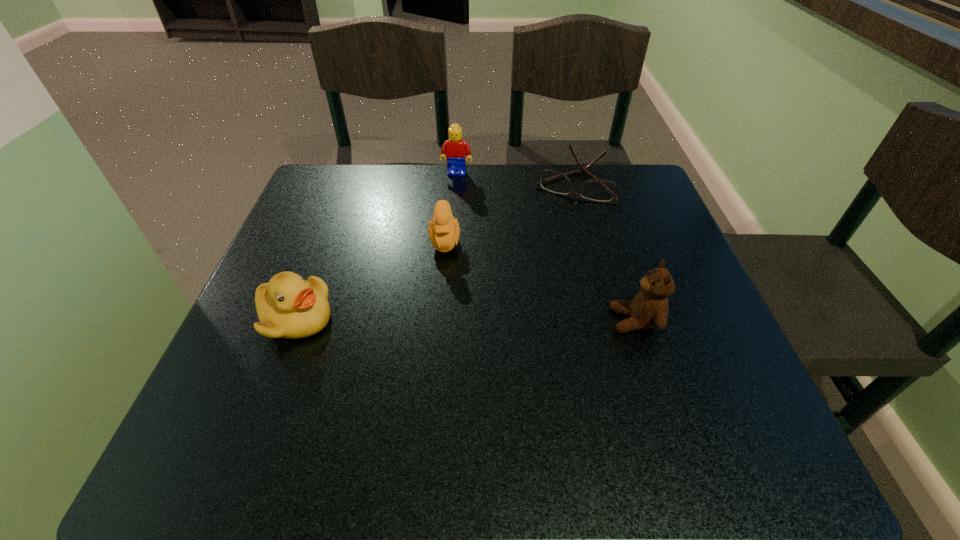
Where is `spectacles located in the far edge section of the desktop`? This screenshot has width=960, height=540. spectacles located in the far edge section of the desktop is located at coordinates (598, 190).

Identify the location of Lego that is at the far edge. (456, 149).

You are a GUI agent. You are given a task and a screenshot of the screen. Output one action in this format:
    pyautogui.click(x=<x>, y=<y>)
    Task: Click on the object located at the left edge
    The width and height of the screenshot is (960, 540).
    Given the screenshot: What is the action you would take?
    pyautogui.click(x=288, y=306)

Find the location of a particular element. Image resolution: width=960 pixels, height=540 pixels. teddy bear present at the right edge is located at coordinates (649, 308).

In order to click on spectacles that is at the right edge in this screenshot , I will do `click(598, 190)`.

You are a GUI agent. You are given a task and a screenshot of the screen. Output one action in this format:
    pyautogui.click(x=<x>, y=<y>)
    Task: Click on the object that is at the far right corner
    This screenshot has height=540, width=960.
    Given the screenshot: What is the action you would take?
    pyautogui.click(x=598, y=190)

In order to click on free location at the far edge in this screenshot , I will do `click(554, 203)`.

Image resolution: width=960 pixels, height=540 pixels. I want to click on vacant area at the near edge, so click(x=420, y=369).

Where is `vacant space at the left edge`? The width and height of the screenshot is (960, 540). vacant space at the left edge is located at coordinates (357, 221).

Identify the location of vacant area at the right edge. (627, 226).